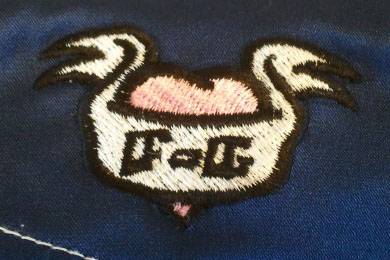
You are a GUI agent. You are given a task and a screenshot of the screen. Output one action in this format:
    pyautogui.click(x=<x>, y=<y>)
    Task: Click on the detail of the white fabric
    
    Given the screenshot: What is the action you would take?
    pyautogui.click(x=260, y=150), pyautogui.click(x=200, y=131), pyautogui.click(x=166, y=123), pyautogui.click(x=125, y=120)